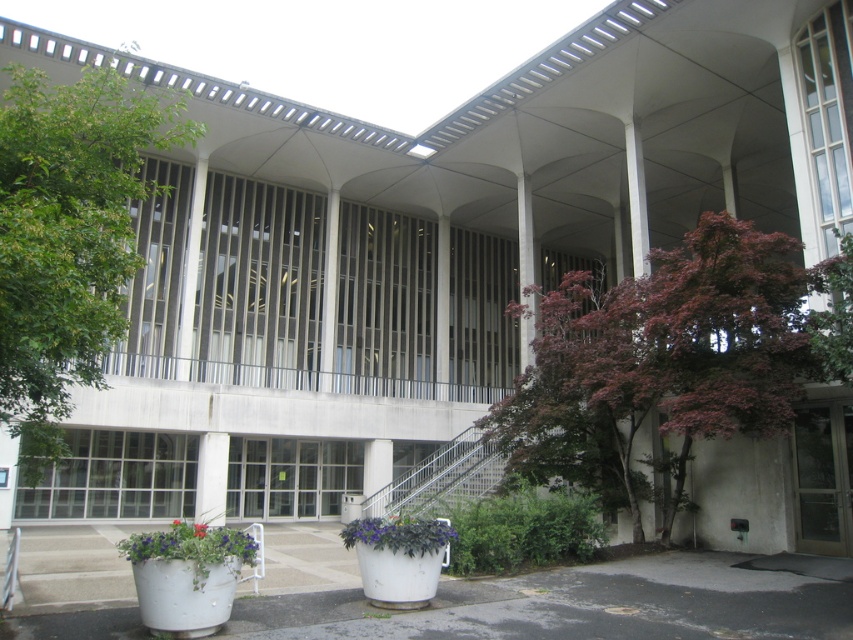
You are a landscape architect designing a pathway between the purple leafy tree at center and the purple matte flower pot at center. If the pathway must be 1 meter wide, will there be enough space between them?

The purple leafy tree at center is wider than the purple matte flower pot at center. However, the exact distance between them isn not specified in the provided information. Without knowing the actual spacing, it is impossible to determine if the 1 meter wide pathway can fit.